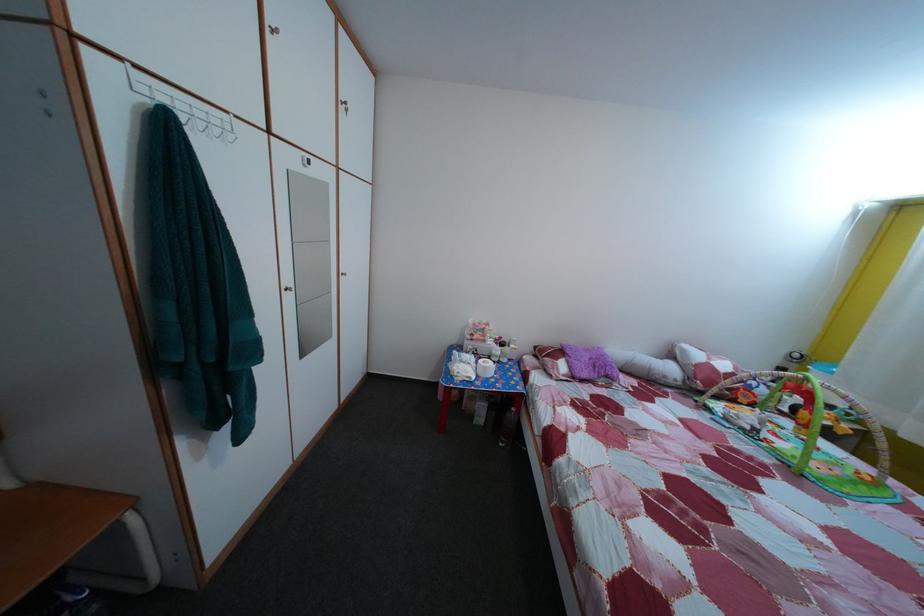
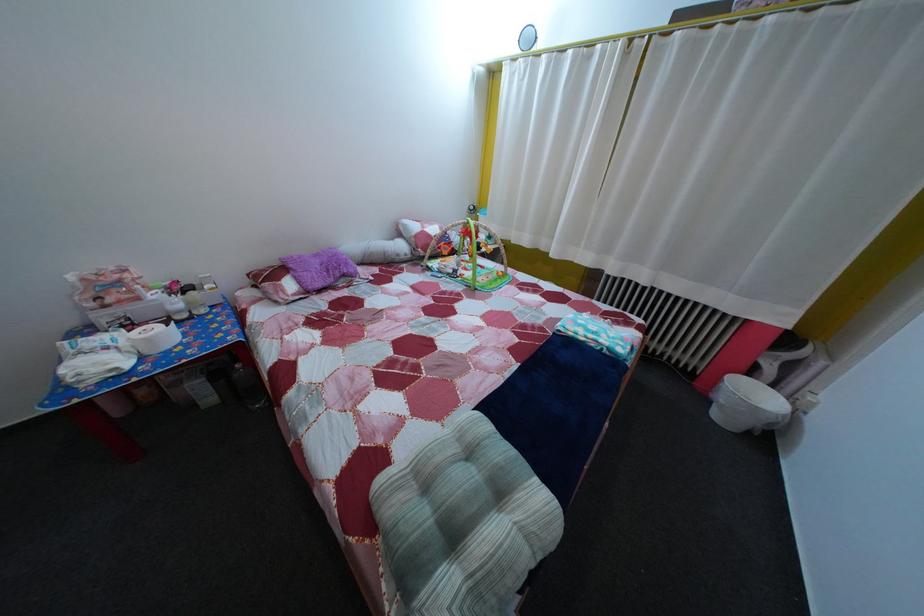
Find the pixel in the second image that matches point (597, 358) in the first image.

(325, 262)